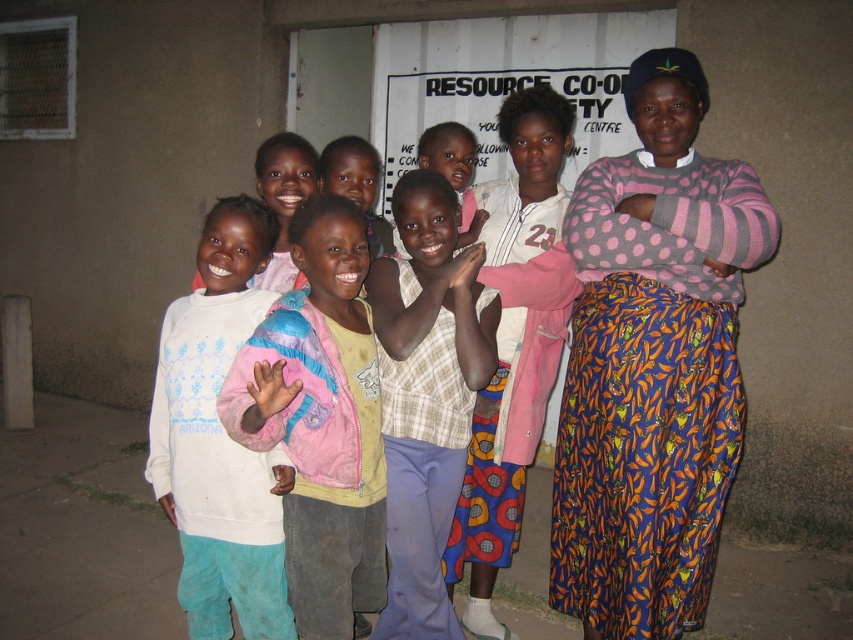
Question: Which object appears farthest from the camera in this image?

Choices:
 (A) checkered fabric dress at center
 (B) white fleece sweatshirt at center
 (C) polka dot sweater at center

Answer: (A)

Question: Which object is farther from the camera taking this photo?

Choices:
 (A) polka dot sweater at center
 (B) white fleece sweatshirt at center

Answer: (A)

Question: Which point appears closest to the camera in this image?

Choices:
 (A) pos(383,515)
 (B) pos(186,436)
 (C) pos(676,202)

Answer: (C)

Question: Does light blue cotton pants at center appear on the right side of checkered fabric dress at center?

Choices:
 (A) no
 (B) yes

Answer: (A)

Question: Does white fleece sweatshirt at center have a smaller size compared to checkered fabric dress at center?

Choices:
 (A) yes
 (B) no

Answer: (B)

Question: Does light blue cotton pants at center appear on the left side of checkered fabric dress at center?

Choices:
 (A) yes
 (B) no

Answer: (A)